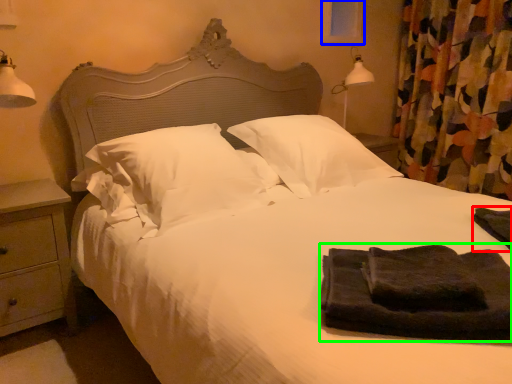
Question: Which object is the closest to the material (highlighted by a red box)? Choose among these: window screen (highlighted by a blue box) or material (highlighted by a green box).

Choices:
 (A) window screen
 (B) material

Answer: (B)